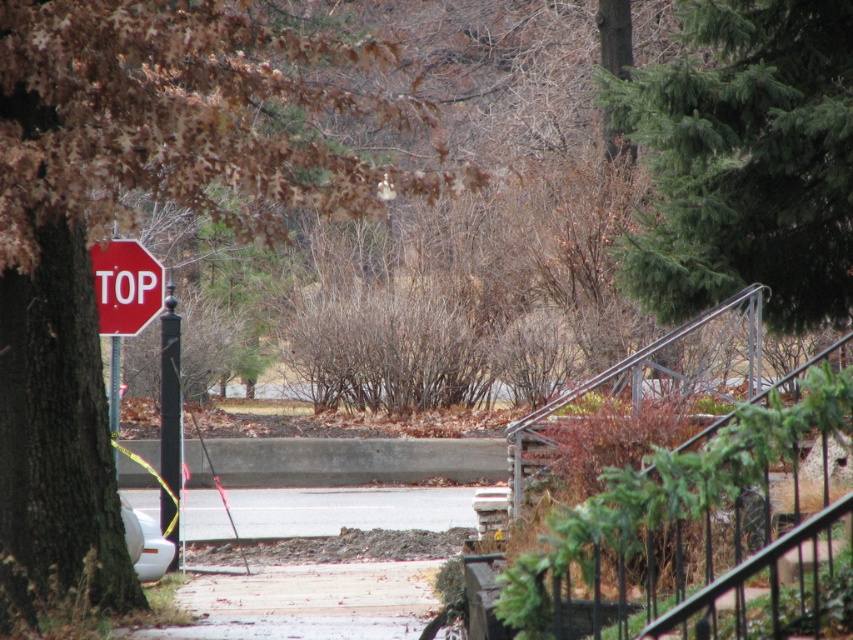
Question: Considering the relative positions of brown matte tree at upper left and black metal pole at left in the image provided, where is brown matte tree at upper left located with respect to black metal pole at left?

Choices:
 (A) above
 (B) below

Answer: (A)

Question: Which point appears closest to the camera in this image?

Choices:
 (A) (659, 125)
 (B) (242, 204)
 (C) (465, 525)
 (D) (131, 250)

Answer: (A)

Question: Among these objects, which one is farthest from the camera?

Choices:
 (A) brown matte tree at upper left
 (B) gray asphalt pavement at center

Answer: (B)

Question: Which object is farther from the camera taking this photo?

Choices:
 (A) red matte stop sign at left
 (B) black metal pole at left

Answer: (B)

Question: Can you confirm if gray asphalt pavement at center is bigger than black metal pole at left?

Choices:
 (A) no
 (B) yes

Answer: (B)

Question: Does red matte stop sign at left have a smaller size compared to black metal pole at left?

Choices:
 (A) no
 (B) yes

Answer: (A)